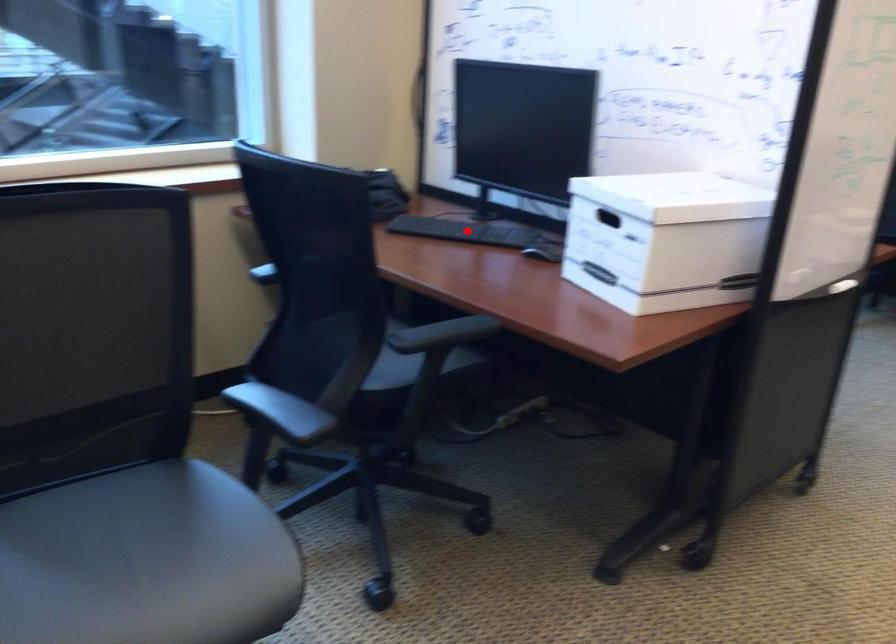
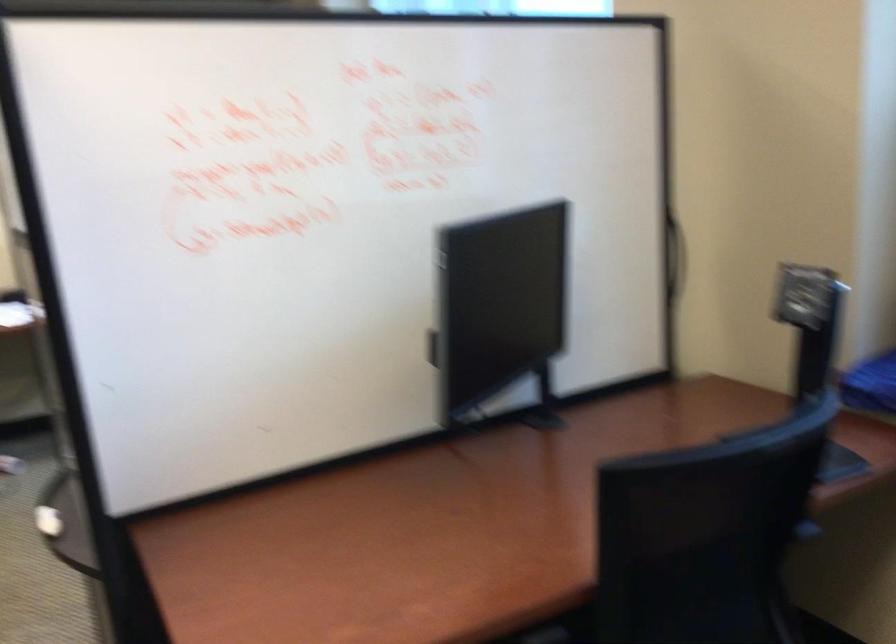
Question: I am providing you with two images of the same scene from different viewpoints. A red point is marked on the first image. Can you still see the location of the red point in image 2?

Choices:
 (A) Yes
 (B) No

Answer: (B)